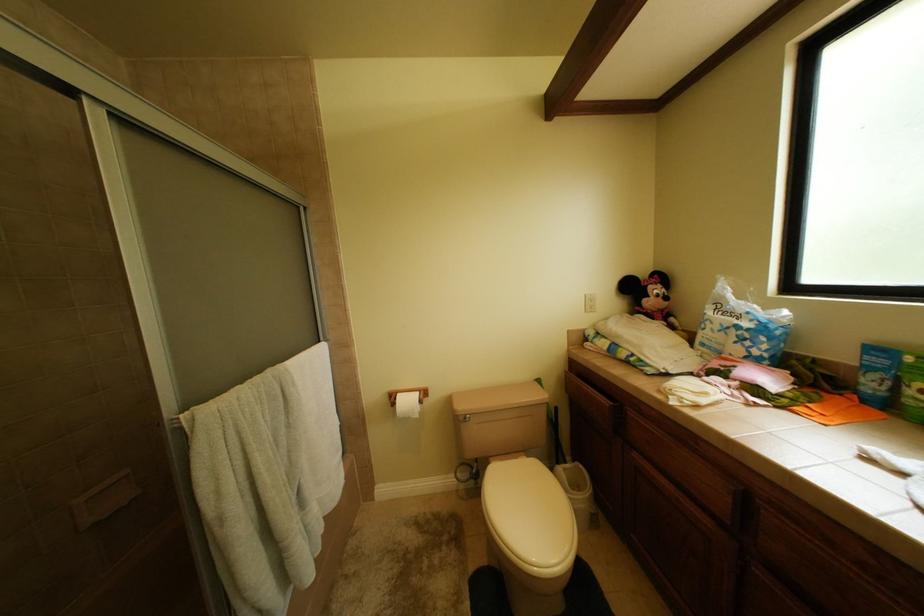
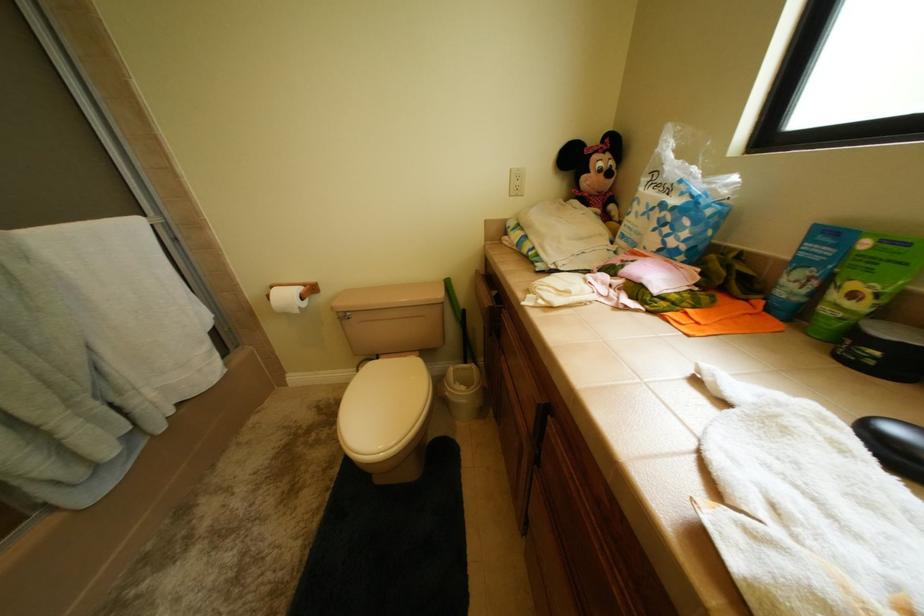
In a continuous first-person perspective shot, in which direction is the camera moving?

The cameraman moved toward right, forward.